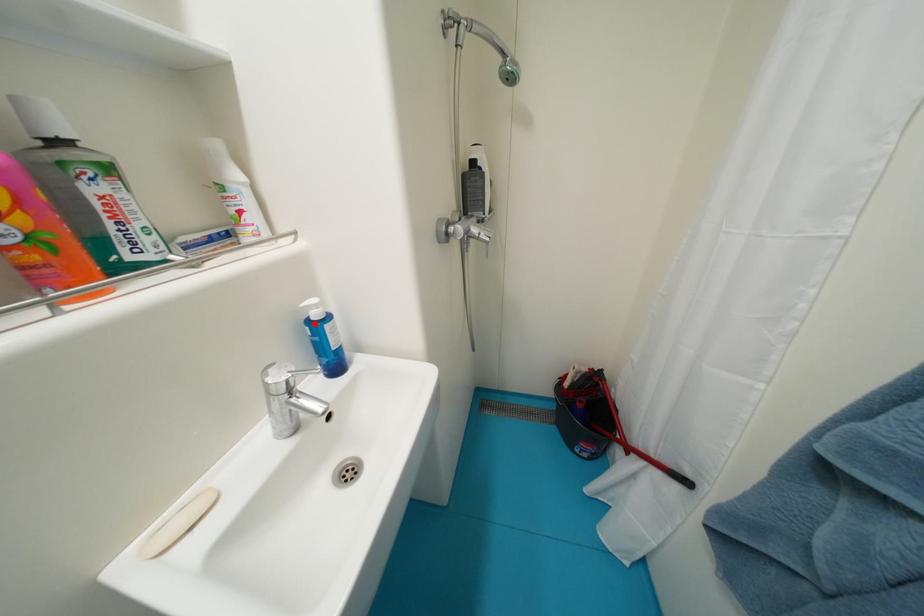
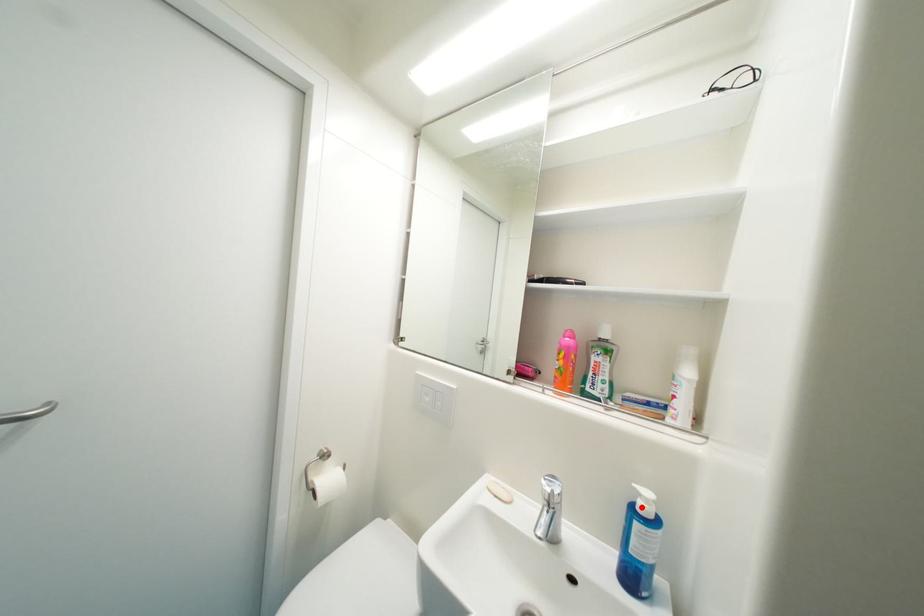
I am providing you with two images of the same scene from different viewpoints. A red point is marked on the first image and another point is marked on the second image. Do the highlighted points in image1 and image2 indicate the same real-world spot?

Yes